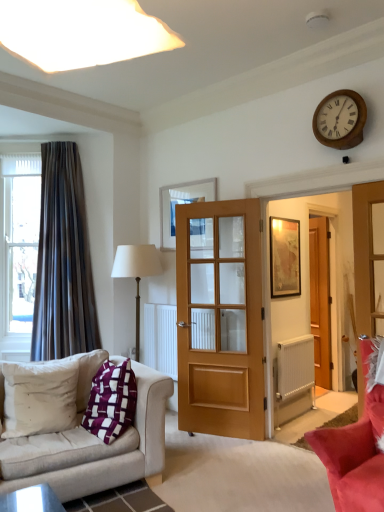
At what (x,y) coordinates should I click in order to perform the action: click on vacant area that is in front of light brown wooden door at center, the second door viewed from the right. Please return your answer as a coordinate pair (x, y). The height and width of the screenshot is (512, 384). Looking at the image, I should click on click(225, 454).